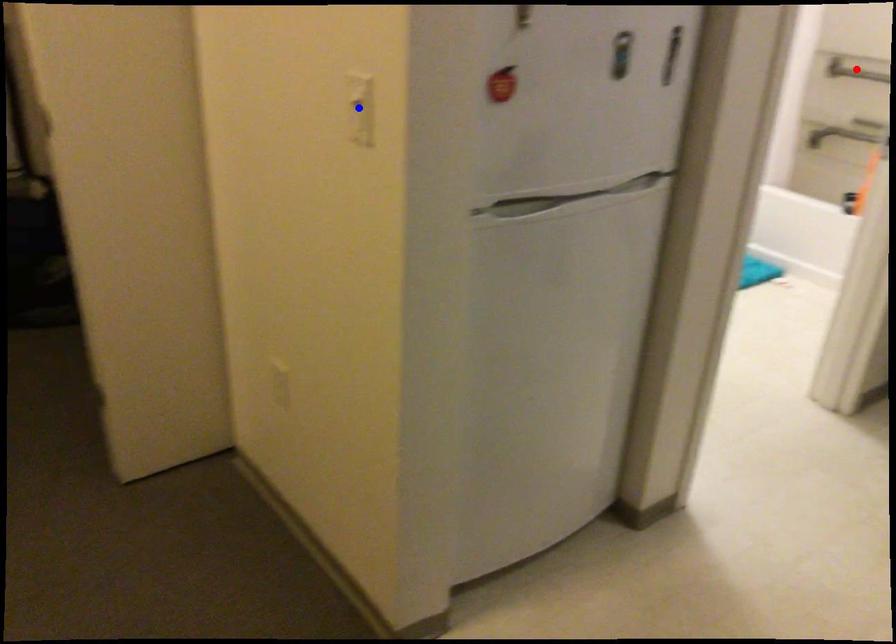
Question: Which of the two points in the image is closer to the camera?

Choices:
 (A) Blue point is closer.
 (B) Red point is closer.

Answer: (A)